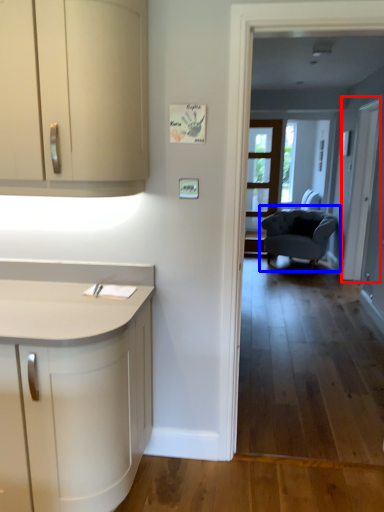
Question: Which object appears closest to the camera in this image, screen door (highlighted by a red box) or chair (highlighted by a blue box)?

Choices:
 (A) screen door
 (B) chair

Answer: (A)